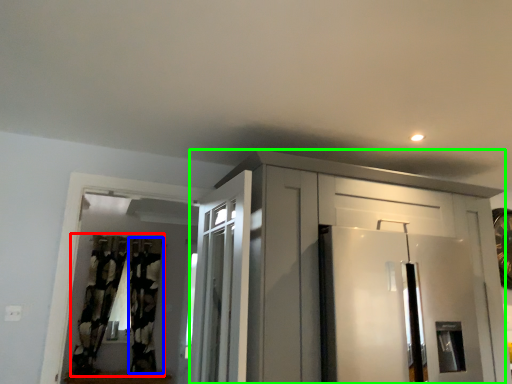
Question: Considering the real-world distances, which object is closest to curtain (highlighted by a red box)? curtain (highlighted by a blue box) or cabinetry (highlighted by a green box).

Choices:
 (A) curtain
 (B) cabinetry

Answer: (A)